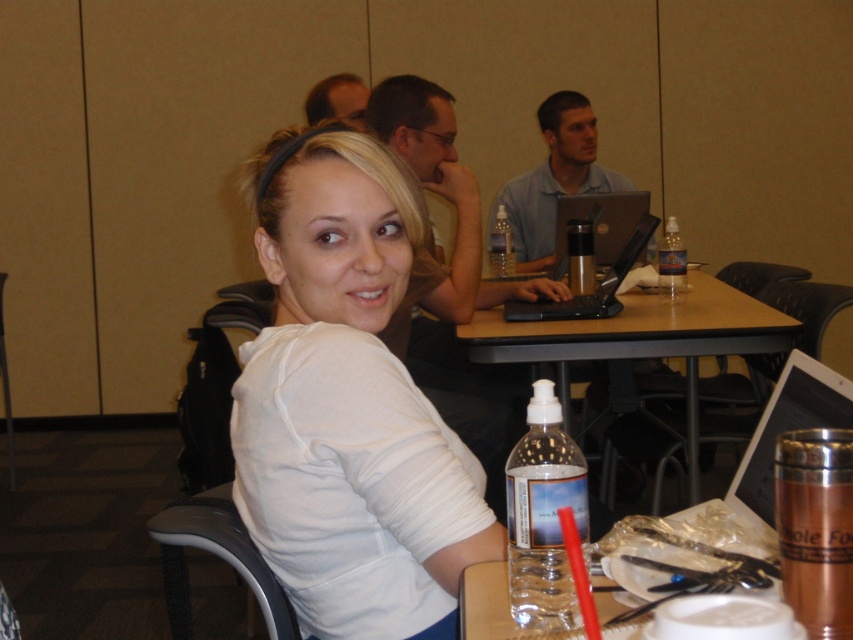
Is light blue shirt at center thinner than clear plastic bottle at center?

No.

Locate an element on the screen. The width and height of the screenshot is (853, 640). light blue shirt at center is located at coordinates (555, 177).

Can you confirm if light blue shirt at center is wider than gray plastic chair at lower left?

Correct, the width of light blue shirt at center exceeds that of gray plastic chair at lower left.

This screenshot has height=640, width=853. What do you see at coordinates (555, 177) in the screenshot?
I see `light blue shirt at center` at bounding box center [555, 177].

At what (x,y) coordinates should I click in order to perform the action: click on light blue shirt at center. Please return your answer as a coordinate pair (x, y). Looking at the image, I should click on (555, 177).

How distant is brown wooden table at center from gray plastic chair at lower left?

brown wooden table at center is 5.30 feet from gray plastic chair at lower left.

Which is behind, point (579, 356) or point (216, 524)?

Point (579, 356)

Locate an element on the screen. This screenshot has width=853, height=640. brown wooden table at center is located at coordinates (640, 342).